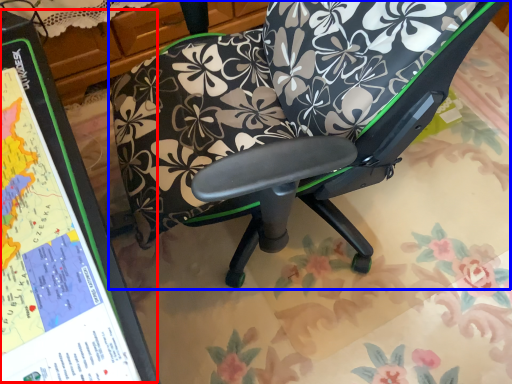
Question: Which object appears closest to the camera in this image, bulletin board (highlighted by a red box) or chair (highlighted by a blue box)?

Choices:
 (A) bulletin board
 (B) chair

Answer: (A)